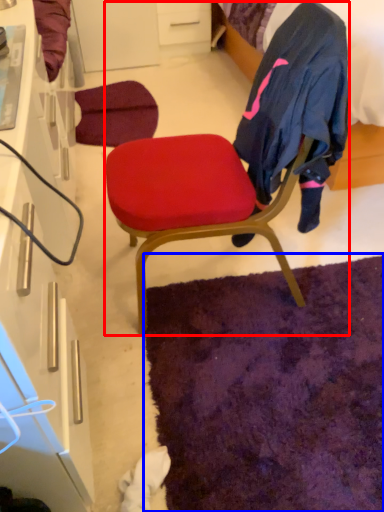
Question: Which object appears farthest to the camera in this image, chair (highlighted by a red box) or mat (highlighted by a blue box)?

Choices:
 (A) chair
 (B) mat

Answer: (B)